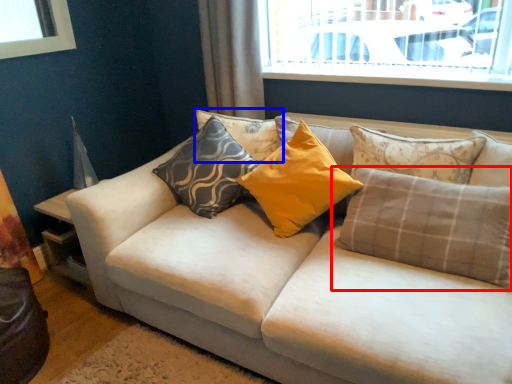
Question: Which object is closer to the camera taking this photo, pillow (highlighted by a red box) or pillow (highlighted by a blue box)?

Choices:
 (A) pillow
 (B) pillow

Answer: (A)